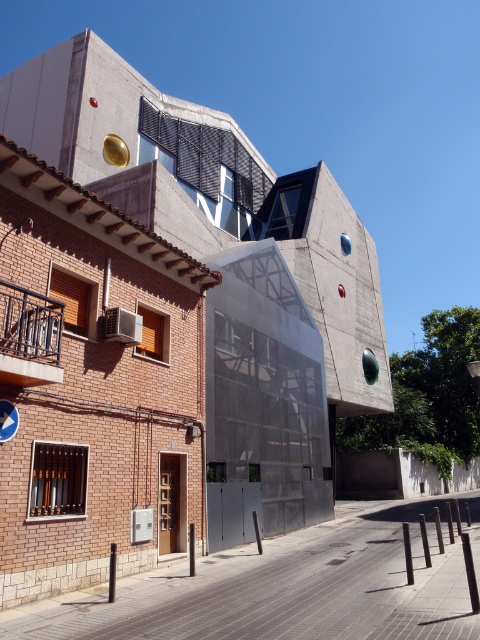
Is concrete building at center positioned at the back of blue plastic sign at center?

No, it is in front of blue plastic sign at center.

Which is in front, point (157, 488) or point (1, 433)?

Point (1, 433) is more forward.

Does point (316, 243) come farther from viewer compared to point (10, 435)?

Yes.

Image resolution: width=480 pixels, height=640 pixels. Identify the location of concrete building at center. (166, 326).